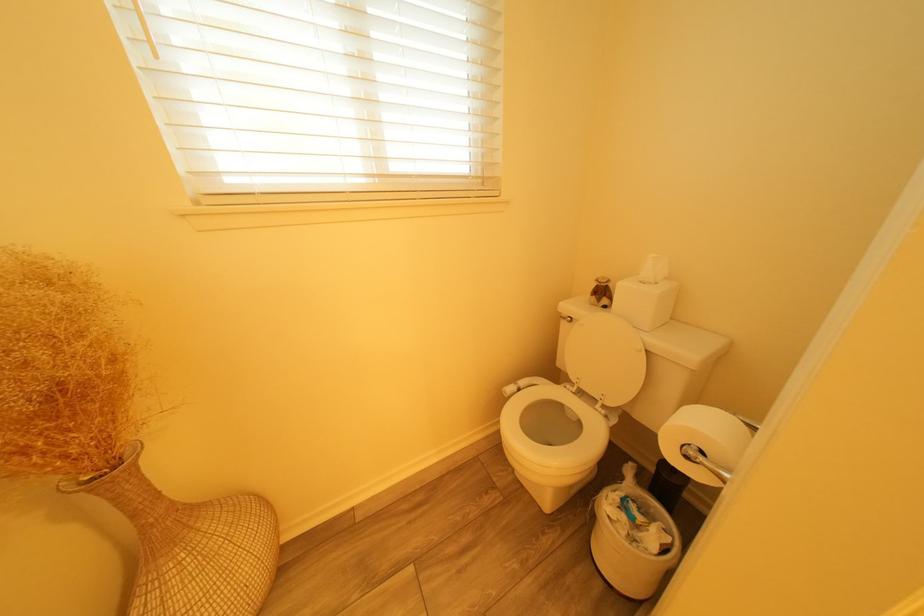
Find where to lower the white toilet seat. Please return your answer as a coordinate pair (x, y).

(550, 423)